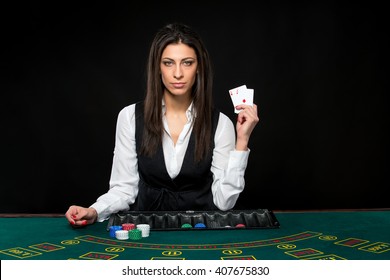
Identify the location of poker table. (254, 250).